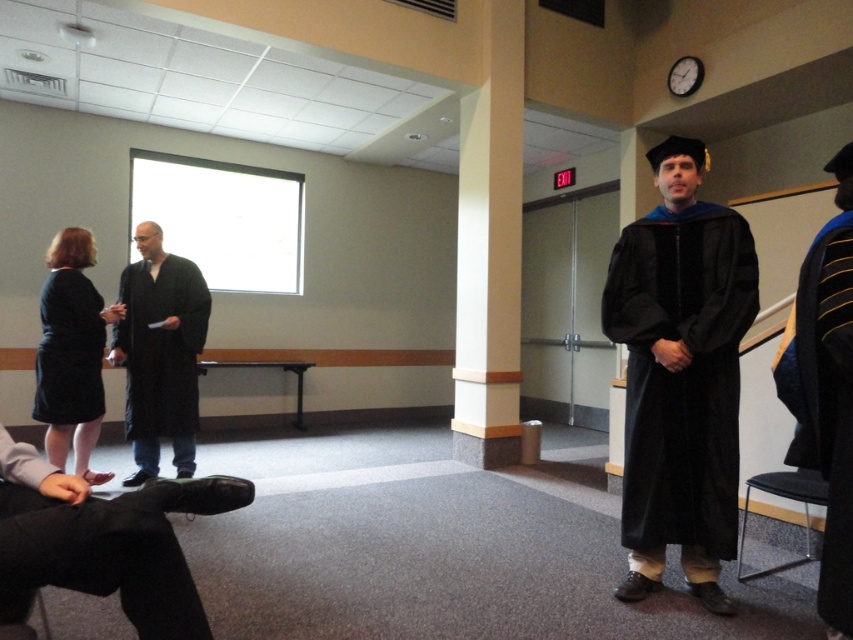
You are a photographer setting up for a graduation ceremony. You need to position a light source so it illuminates both the black matte robe at left and the black matte dress at left without causing harsh shadows. Given their positions, where should you place the light source relative to these two items?

The black matte robe at left is located below the black matte dress at left. To avoid harsh shadows, the light source should be placed above both the black matte robe at left and the black matte dress at left so that the light falls evenly on both items.